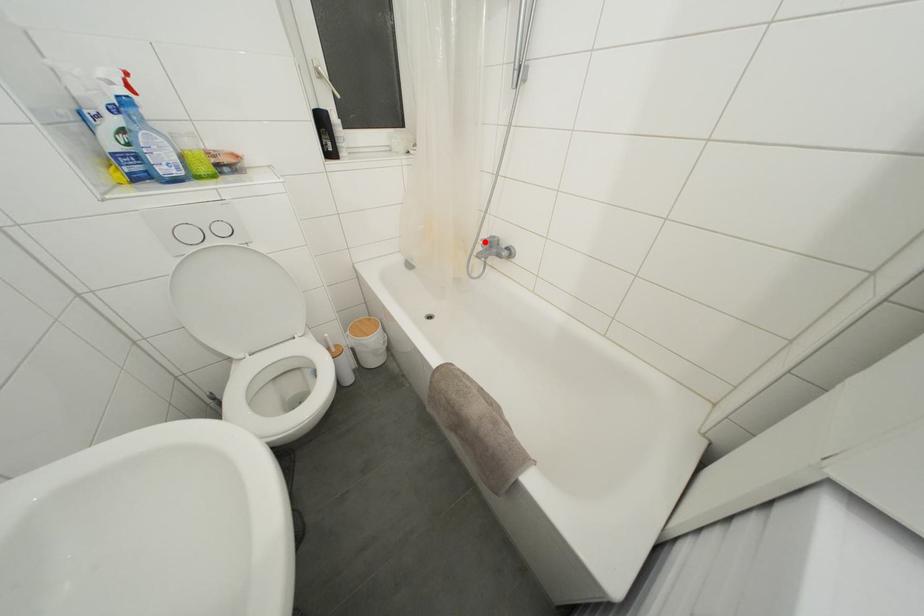
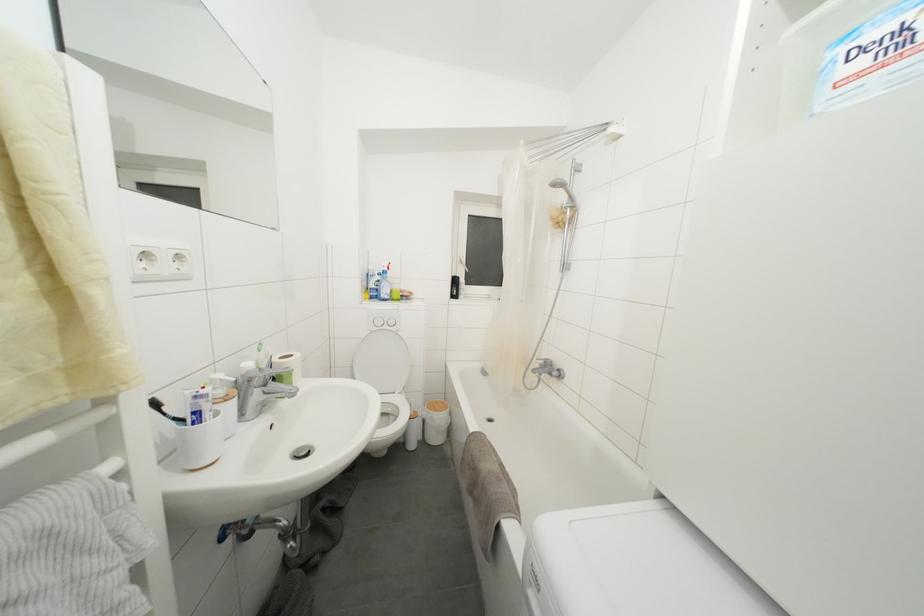
Question: I am providing you with two images of the same scene from different viewpoints. In image1, a red point is highlighted. Considering the same 3D point in image2, which of the following is correct?

Choices:
 (A) It is closer
 (B) It is farther

Answer: (B)